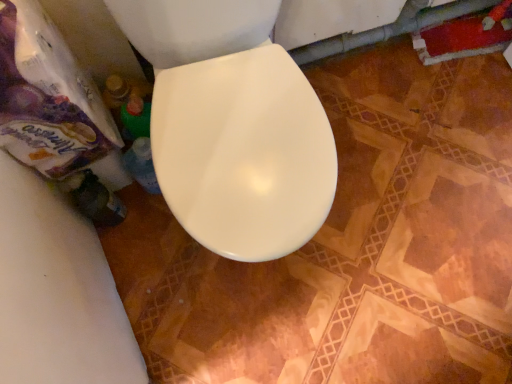
Locate an element on the screen. Image resolution: width=512 pixels, height=384 pixels. white glossy toilet seat at center is located at coordinates (244, 153).

Describe the element at coordinates (244, 153) in the screenshot. I see `white glossy toilet seat at center` at that location.

Locate an element on the screen. white glossy toilet seat at center is located at coordinates pos(244,153).